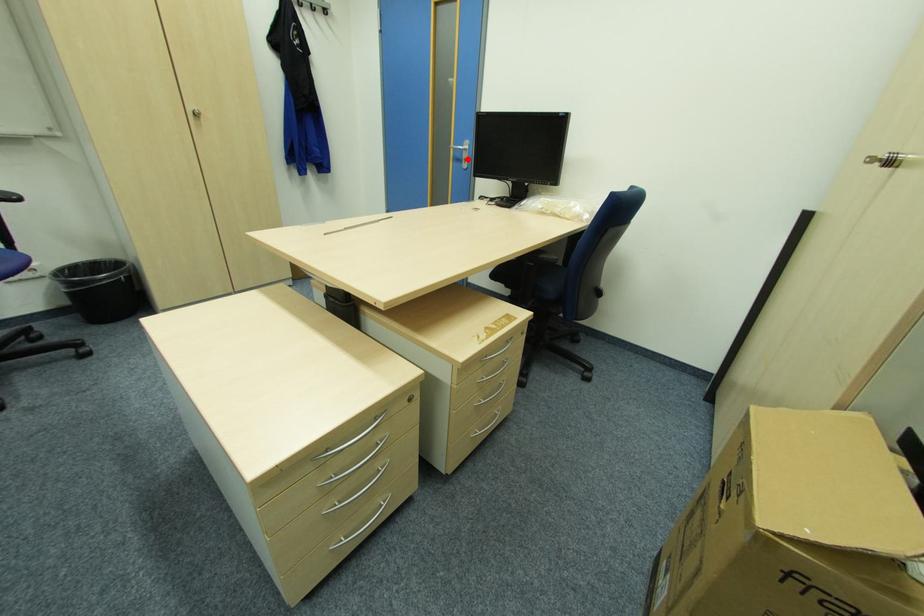
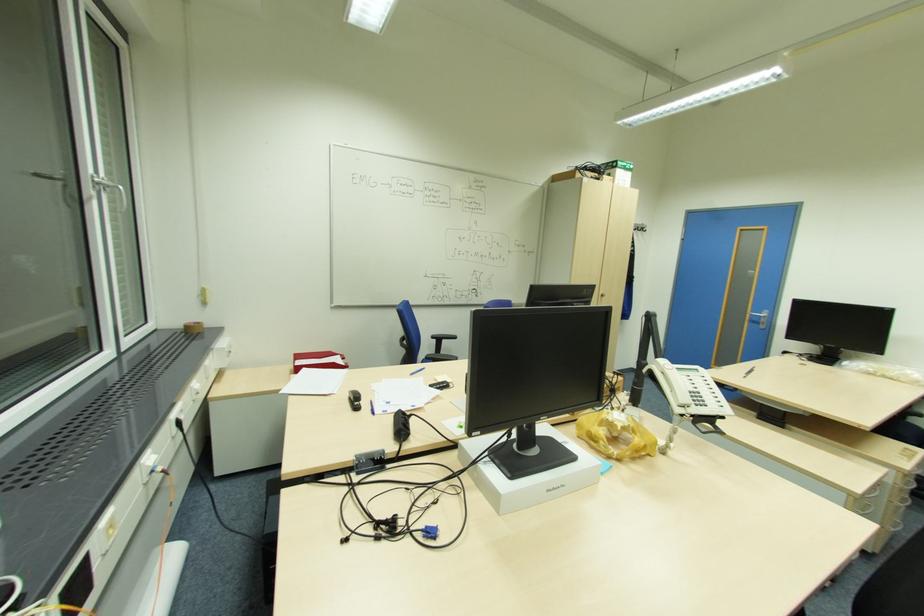
The point at the highlighted location is marked in the first image. Where is the corresponding point in the second image?

(766, 323)